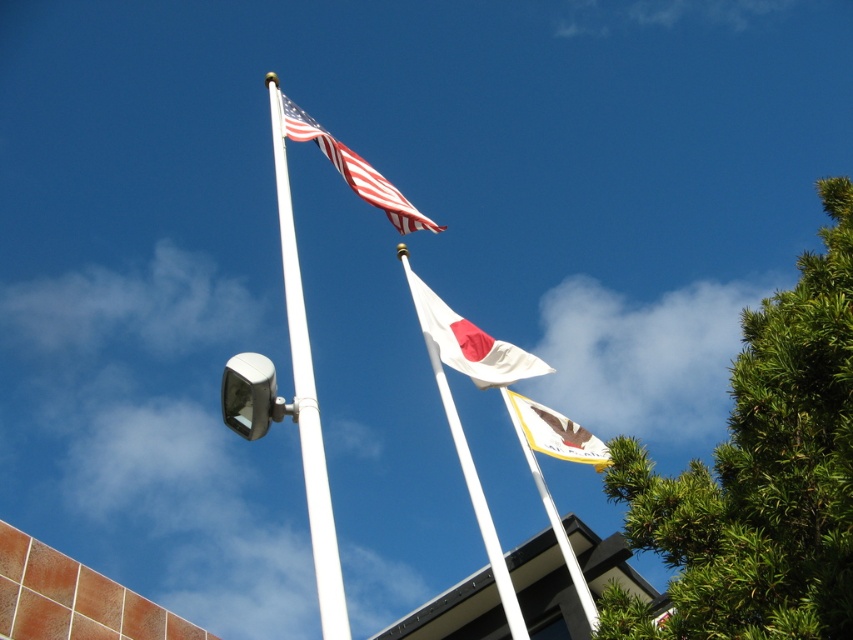
Is white metallic pole at upper left shorter than yellow fabric flag at center?

No, white metallic pole at upper left is not shorter than yellow fabric flag at center.

Who is taller, white metallic pole at upper left or yellow fabric flag at center?

With more height is white metallic pole at upper left.

Is point (294, 381) positioned behind point (590, 461)?

No.

At what (x,y) coordinates should I click in order to perform the action: click on white metallic pole at upper left. Please return your answer as a coordinate pair (x, y). This screenshot has height=640, width=853. Looking at the image, I should click on (306, 397).

I want to click on green leafy tree at right, so click(759, 476).

Can you confirm if green leafy tree at right is positioned to the right of white matte flag at center?

Yes, green leafy tree at right is to the right of white matte flag at center.

Between point (764, 333) and point (486, 358), which one is positioned behind?

Point (486, 358)

Identify the location of green leafy tree at right. This screenshot has height=640, width=853. (759, 476).

Can you confirm if yellow fabric flag at upper center is positioned to the right of white matte flag pole at center?

Indeed, yellow fabric flag at upper center is positioned on the right side of white matte flag pole at center.

Who is more forward, (572, 570) or (428, 336)?

Point (572, 570) is in front.

Image resolution: width=853 pixels, height=640 pixels. Find the location of `yellow fabric flag at upper center`. yellow fabric flag at upper center is located at coordinates (561, 458).